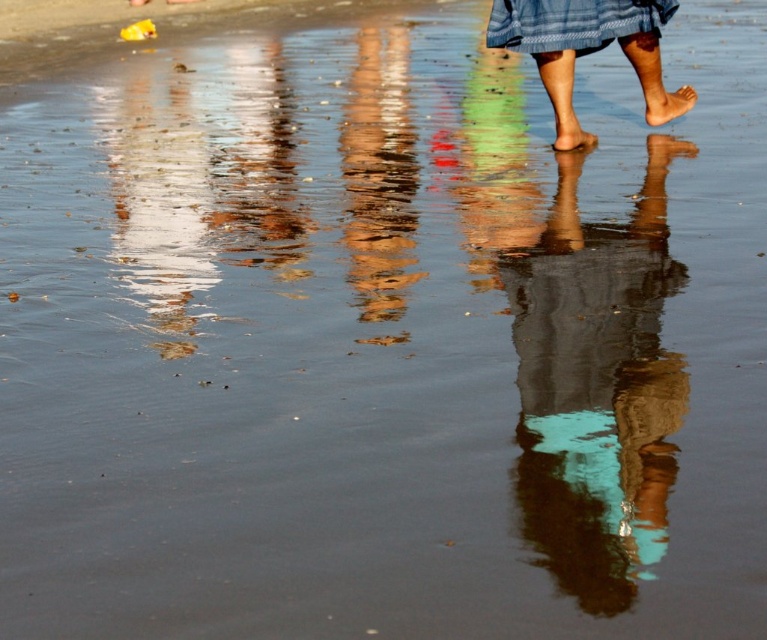
I want to click on shiny metallic pole at center, so click(379, 176).

Is shiny metallic pole at center positioned before matte skin foot at center?

That is True.

Is point (380, 257) positioned before point (581, 138)?

Yes, point (380, 257) is in front of point (581, 138).

Identify the location of shiny metallic pole at center. This screenshot has height=640, width=767. (379, 176).

Who is more distant from viewer, (584,19) or (650,118)?

The point (650,118) is more distant.

What do you see at coordinates (588, 45) in the screenshot? I see `blue plaid skirt at upper center` at bounding box center [588, 45].

Who is more distant from viewer, [652,60] or [686,99]?

The point [686,99] is behind.

Find the location of `blue plaid skirt at upper center`. blue plaid skirt at upper center is located at coordinates (588, 45).

Does point (359, 48) come closer to viewer compared to point (673, 100)?

No, (359, 48) is further to viewer.

Who is taller, shiny metallic pole at center or smooth skin foot at center?

With more height is shiny metallic pole at center.

Which is behind, point (384, 188) or point (649, 112)?

The point (649, 112) is more distant.

This screenshot has width=767, height=640. Identify the location of shiny metallic pole at center. (379, 176).